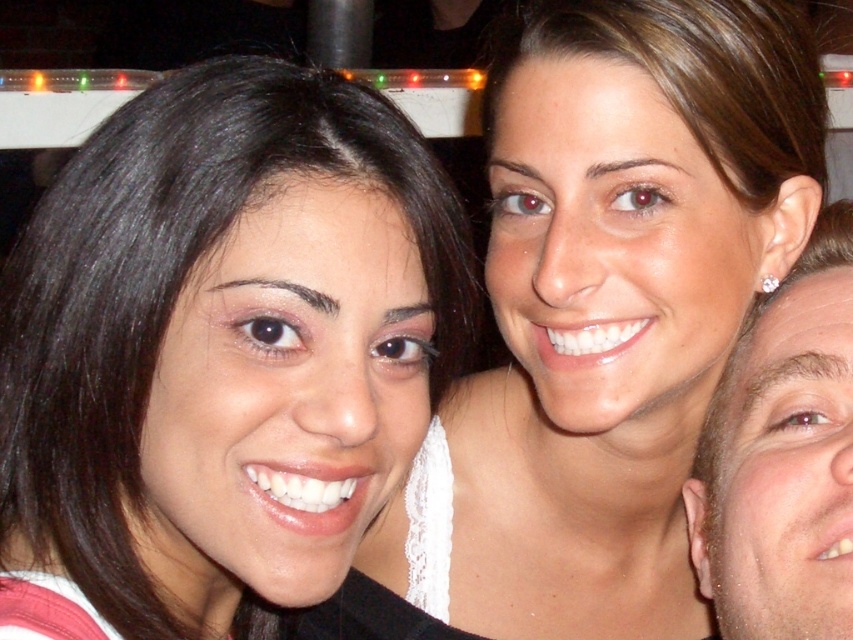
Question: Does matte black hair at left have a lesser width compared to matte white top at center?

Choices:
 (A) no
 (B) yes

Answer: (B)

Question: Is matte white top at center smaller than smooth skin face at right?

Choices:
 (A) no
 (B) yes

Answer: (A)

Question: From the image, what is the correct spatial relationship of matte white top at center in relation to smooth skin face at right?

Choices:
 (A) below
 (B) above

Answer: (B)

Question: Which of the following is the closest to the observer?

Choices:
 (A) smooth skin face at right
 (B) matte white top at center
 (C) matte black hair at left

Answer: (C)

Question: Which of the following is the farthest from the observer?

Choices:
 (A) matte white top at center
 (B) matte black hair at left
 (C) smooth skin face at right

Answer: (A)

Question: Which of the following is the farthest from the observer?

Choices:
 (A) matte white top at center
 (B) matte black hair at left

Answer: (A)